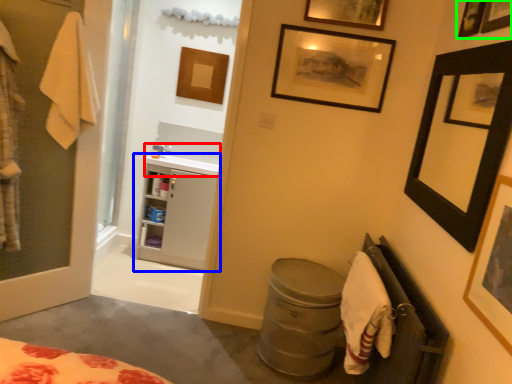
Question: Based on their relative distances, which object is nearer to sink (highlighted by a red box)? Choose from bathroom cabinet (highlighted by a blue box) and picture frame (highlighted by a green box).

Choices:
 (A) bathroom cabinet
 (B) picture frame

Answer: (A)